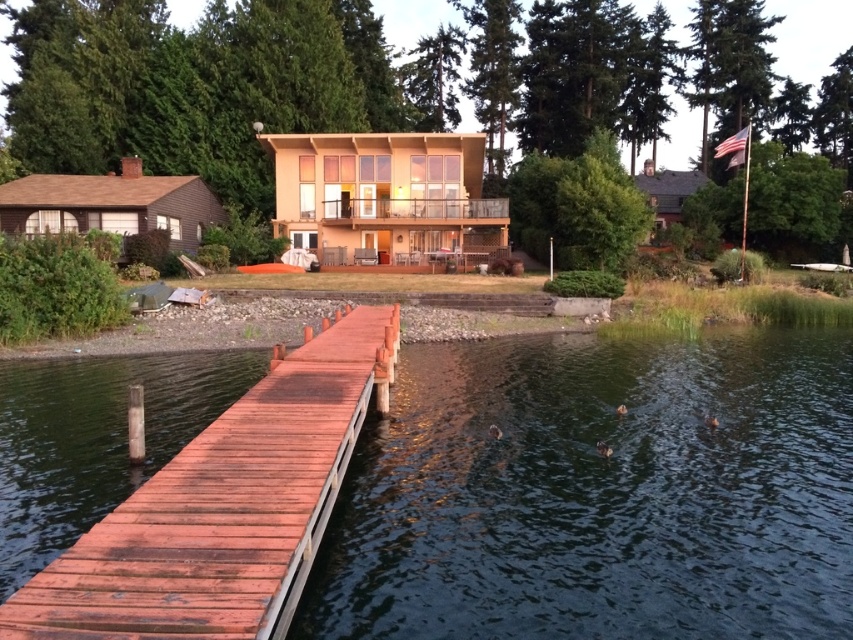
You are standing at the point with coordinates (599,492) in the image. What is located at this exact point?

The point at coordinates (599,492) is occupied by dark blue water at lower center.

You are standing at the edge of the wooden dock and want to reach the dark blue water at lower center. Which direction should you move to get closer to it?

The dark blue water at lower center is located at point (599, 492), so you should move towards the lower center direction to reach it.